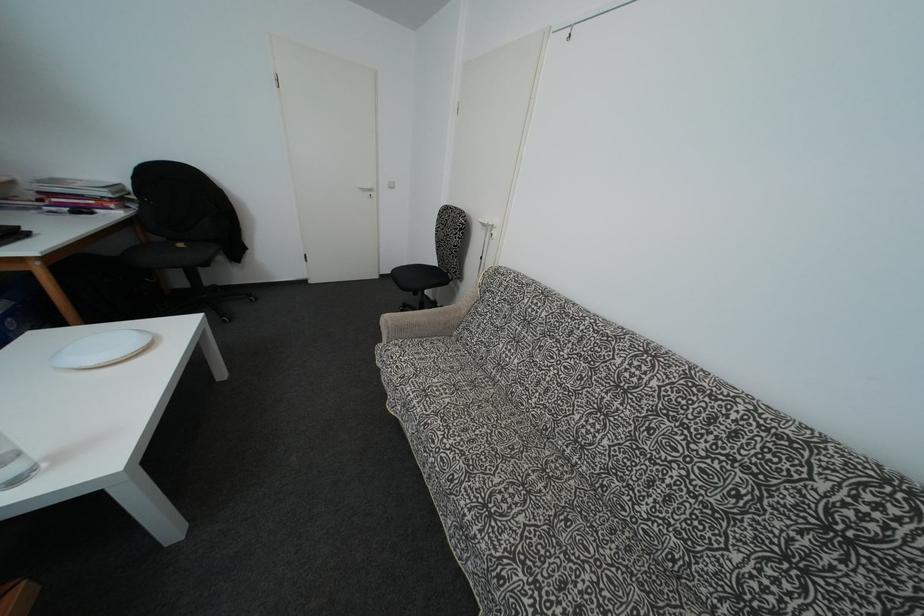
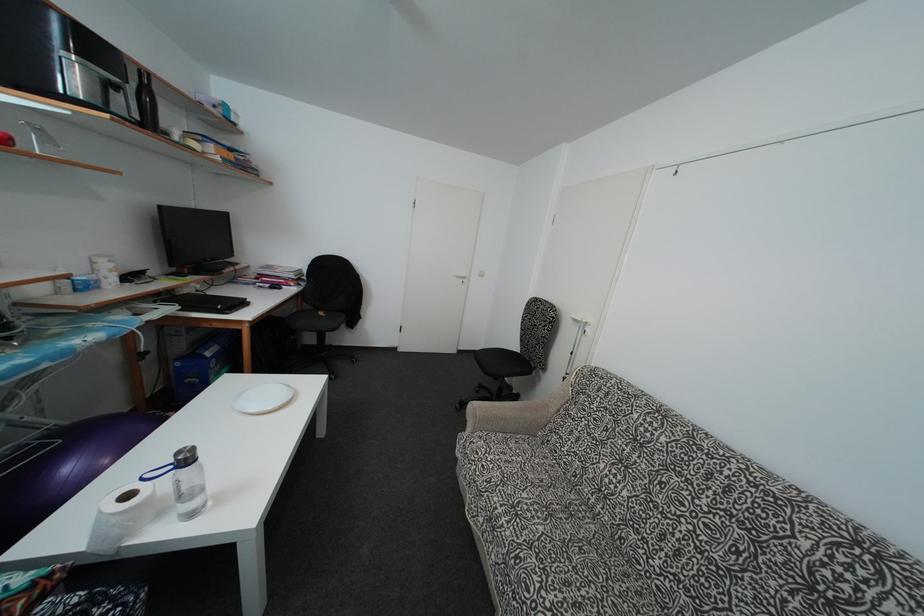
Locate, in the second image, the point that corresponds to (x=438, y=448) in the first image.

(532, 598)